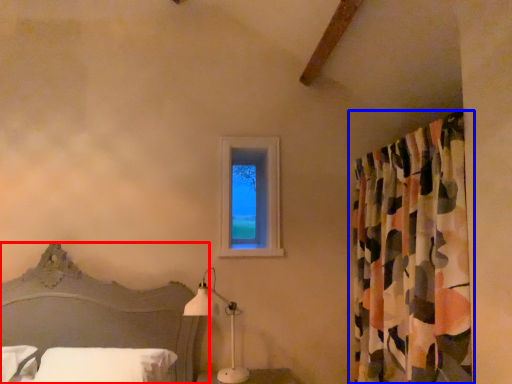
Question: Which point is closer to the camera, bed (highlighted by a red box) or curtain (highlighted by a blue box)?

Choices:
 (A) bed
 (B) curtain

Answer: (A)